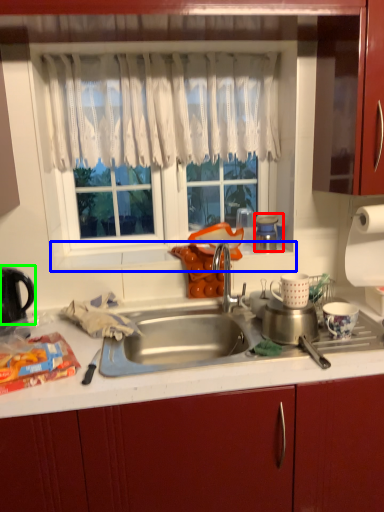
Question: Considering the real-world distances, which object is farthest from appliance (highlighted by a red box)? window sill (highlighted by a blue box) or kitchen appliance (highlighted by a green box)?

Choices:
 (A) window sill
 (B) kitchen appliance

Answer: (B)